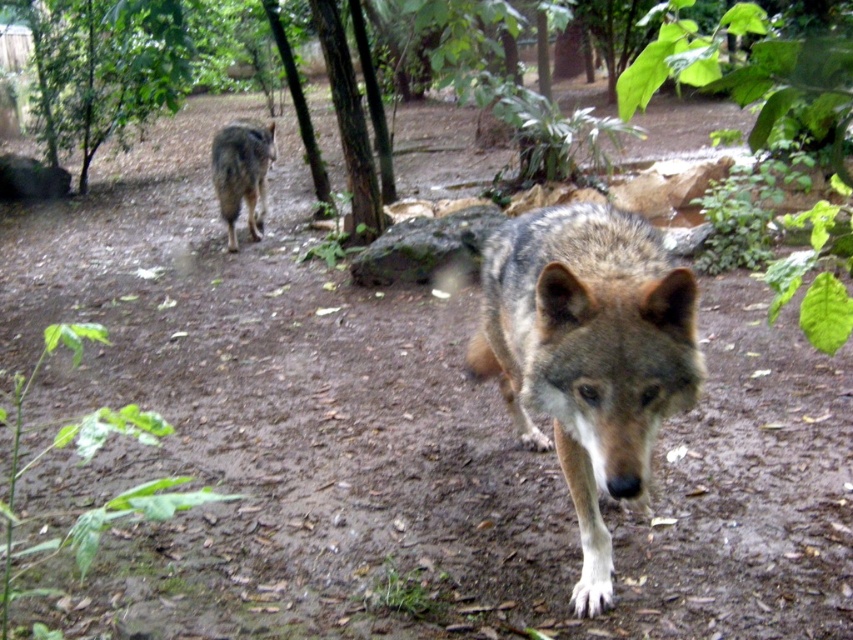
Which is below, gray fur wolf at center or green leafy tree at upper left?

gray fur wolf at center is below.

Does point (566, 355) come closer to viewer compared to point (82, 176)?

Yes.

Identify the location of gray fur wolf at center. The width and height of the screenshot is (853, 640). (587, 355).

Find the location of a particular element. The image size is (853, 640). gray fur wolf at center is located at coordinates (587, 355).

Is green leafy tree at upper left to the left of gray fur wolf at upper left from the viewer's perspective?

Yes, green leafy tree at upper left is to the left of gray fur wolf at upper left.

Locate an element on the screen. This screenshot has height=640, width=853. green leafy tree at upper left is located at coordinates (103, 67).

Between point (669, 308) and point (259, 195), which one is positioned in front?

Point (669, 308)

Between gray fur wolf at center and gray fur wolf at upper left, which one appears on the left side from the viewer's perspective?

gray fur wolf at upper left is more to the left.

Does point (573, 369) lie behind point (260, 168)?

No, it is in front of (260, 168).

Where is `gray fur wolf at center`? gray fur wolf at center is located at coordinates (587, 355).